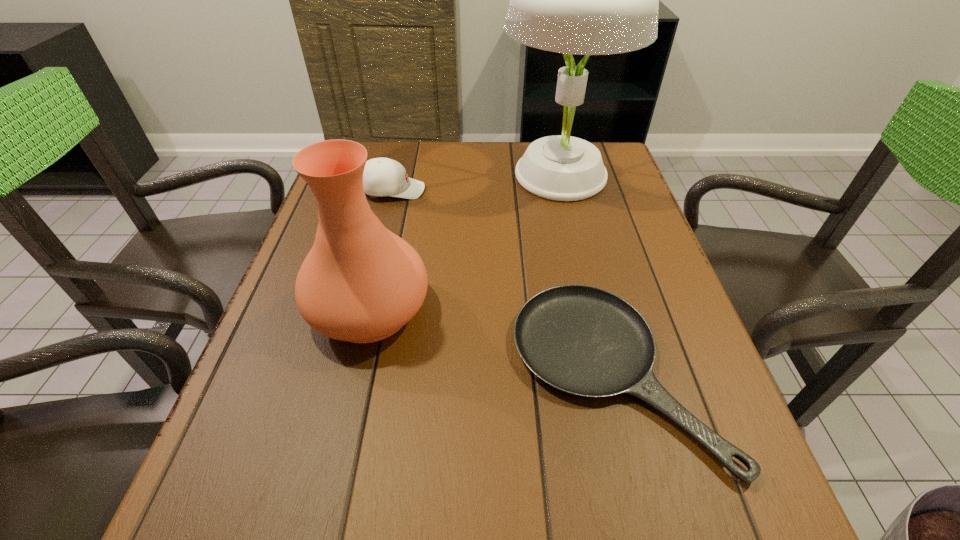
Locate an element on the screen. Image resolution: width=960 pixels, height=540 pixels. vacant space at the left edge of the desktop is located at coordinates (323, 338).

This screenshot has height=540, width=960. In order to click on free region at the right edge in this screenshot , I will do `click(683, 372)`.

Where is `empty space between the baseball cap and the shortest object`? This screenshot has width=960, height=540. empty space between the baseball cap and the shortest object is located at coordinates (503, 282).

The image size is (960, 540). I want to click on vacant area that lies between the baseball cap and the frying pan, so click(503, 282).

Locate an element on the screen. This screenshot has width=960, height=540. vacant space in between the third shortest object and the shortest object is located at coordinates (492, 341).

Find the location of `empty location between the lamp and the third tallest object`. empty location between the lamp and the third tallest object is located at coordinates (475, 183).

Where is `empty space between the second tallest object and the shortest object`? empty space between the second tallest object and the shortest object is located at coordinates (492, 341).

I want to click on free space between the vase and the frying pan, so click(x=492, y=341).

The height and width of the screenshot is (540, 960). What are the coordinates of `empty location between the tallest object and the second tallest object` in the screenshot? It's located at (464, 242).

Image resolution: width=960 pixels, height=540 pixels. I want to click on vacant area between the second shortest object and the lamp, so click(475, 183).